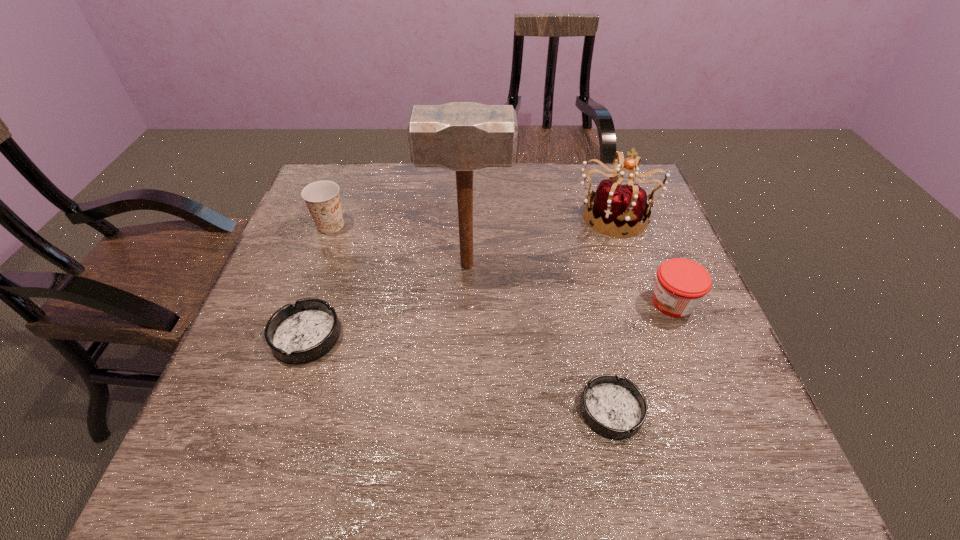
Please point a spot to place another ashtray for symmetrical spacing. Please provide its 2D coordinates. Your answer should be formatted as a tuple, i.e. [(x, y)], where the tuple contains the x and y coordinates of a point satisfying the conditions above.

[(448, 371)]